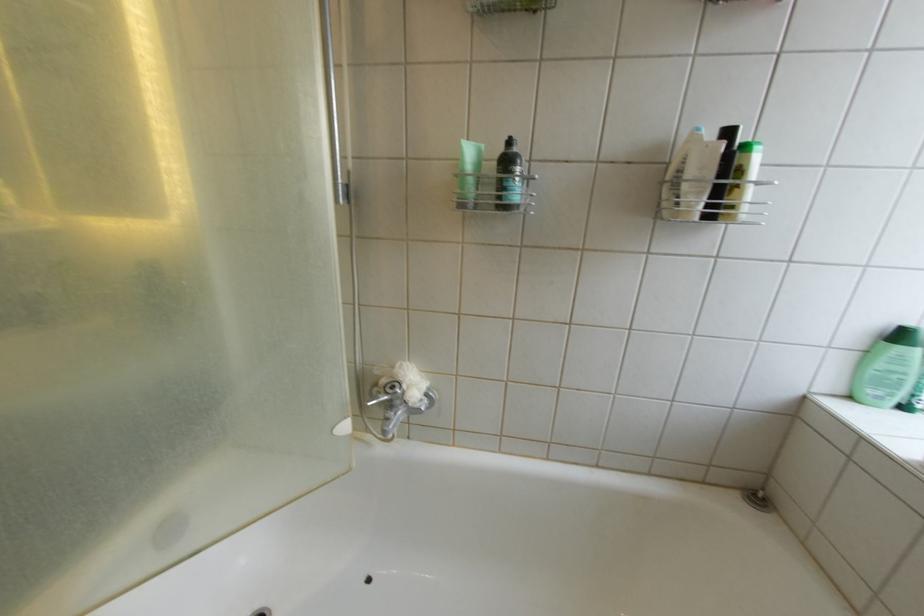
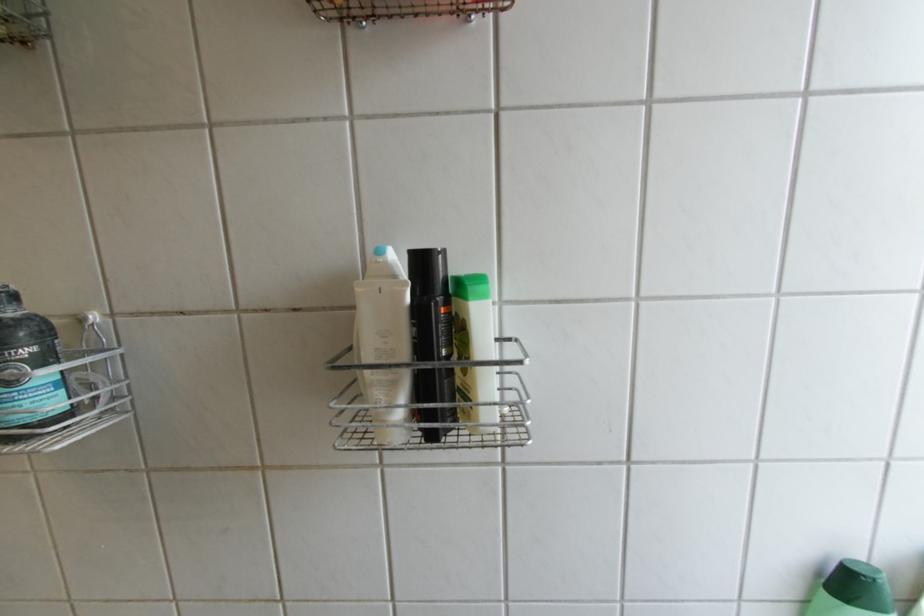
In a continuous first-person perspective shot, in which direction is the camera moving?

The movement direction of the cameraman is right, forward.